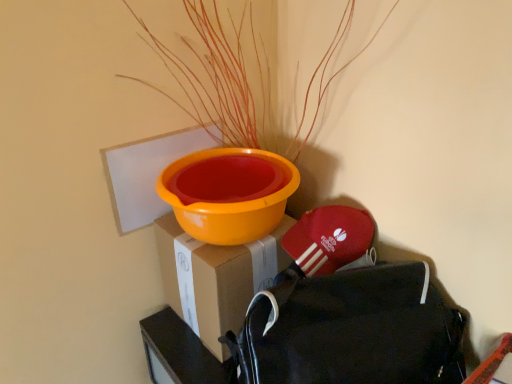
Question: Can you confirm if cardboard box at center is wider than orange matte plant at upper center?

Choices:
 (A) no
 (B) yes

Answer: (A)

Question: Is cardboard box at center far from orange matte plant at upper center?

Choices:
 (A) no
 (B) yes

Answer: (A)

Question: Is cardboard box at center to the left of orange matte plant at upper center from the viewer's perspective?

Choices:
 (A) no
 (B) yes

Answer: (B)

Question: Does cardboard box at center touch orange matte plant at upper center?

Choices:
 (A) yes
 (B) no

Answer: (B)

Question: Is cardboard box at center oriented away from orange matte plant at upper center?

Choices:
 (A) no
 (B) yes

Answer: (A)

Question: Considering the relative positions of cardboard box at center and orange matte plant at upper center in the image provided, is cardboard box at center to the right of orange matte plant at upper center from the viewer's perspective?

Choices:
 (A) no
 (B) yes

Answer: (A)

Question: Does black fabric backpack at lower right appear on the right side of orange matte plant at upper center?

Choices:
 (A) yes
 (B) no

Answer: (A)

Question: From a real-world perspective, does black fabric backpack at lower right sit lower than orange matte plant at upper center?

Choices:
 (A) no
 (B) yes

Answer: (B)

Question: Can orange matte plant at upper center be found inside black fabric backpack at lower right?

Choices:
 (A) yes
 (B) no

Answer: (B)

Question: Is black fabric backpack at lower right taller than orange matte plant at upper center?

Choices:
 (A) no
 (B) yes

Answer: (A)

Question: Is black fabric backpack at lower right thinner than orange matte plant at upper center?

Choices:
 (A) yes
 (B) no

Answer: (A)

Question: Is black fabric backpack at lower right wider than orange matte plant at upper center?

Choices:
 (A) yes
 (B) no

Answer: (B)

Question: Is there a large distance between cardboard box at center and black fabric backpack at lower right?

Choices:
 (A) no
 (B) yes

Answer: (A)